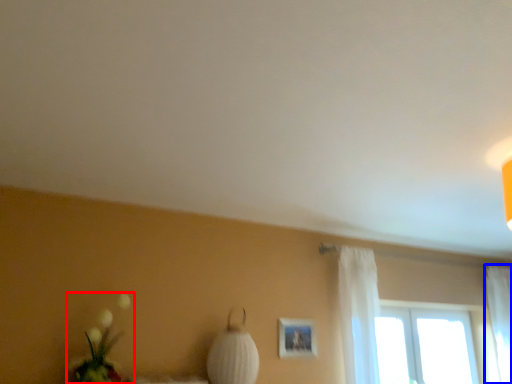
Question: Which point is closer to the camera, floral arrangement (highlighted by a red box) or curtain (highlighted by a blue box)?

Choices:
 (A) floral arrangement
 (B) curtain

Answer: (A)